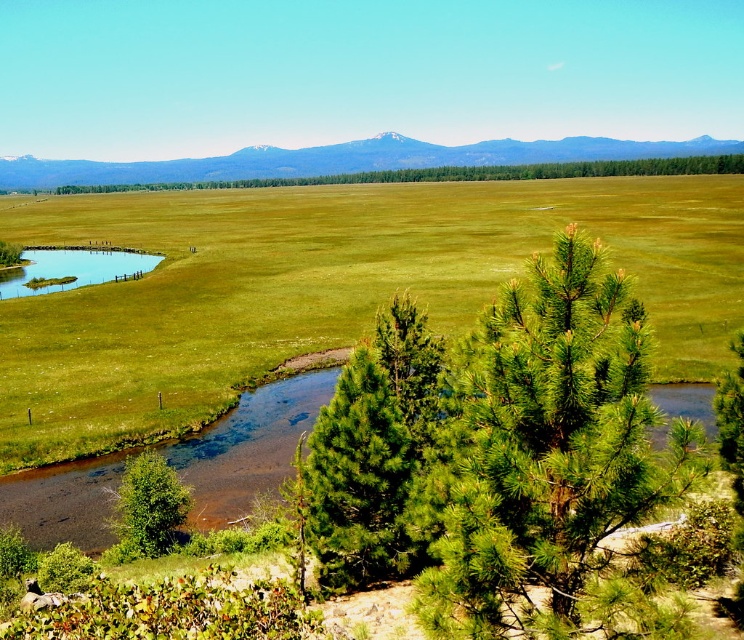
Which is more to the left, green grassy field at center or green leafy tree at lower left?

green grassy field at center

Measure the distance between green grassy field at center and camera.

The distance of green grassy field at center from camera is 183.37 feet.

Between point (719, 308) and point (121, 515), which one is positioned behind?

Point (719, 308)

Identify the location of green grassy field at center. (327, 288).

Which is below, green needle-like at center or green leafy tree at lower left?

green leafy tree at lower left is below.

The width and height of the screenshot is (744, 640). Find the location of `green needle-like at center`. green needle-like at center is located at coordinates (504, 460).

Can you confirm if green needle-like at center is thinner than green pine tree at center?

Yes.

Is point (577, 442) less distant than point (452, 170)?

Yes, point (577, 442) is closer to viewer.

Measure the distance between green needle-like at center and camera.

green needle-like at center and camera are 9.59 meters apart from each other.

Locate an element on the screen. This screenshot has width=744, height=640. green needle-like at center is located at coordinates (504, 460).